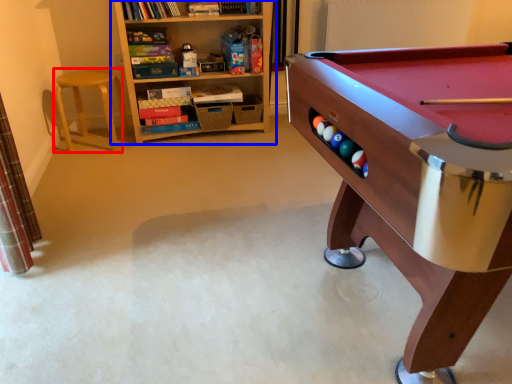
Question: Which object appears closest to the camera in this image, stool (highlighted by a red box) or bookcase (highlighted by a blue box)?

Choices:
 (A) stool
 (B) bookcase

Answer: (B)